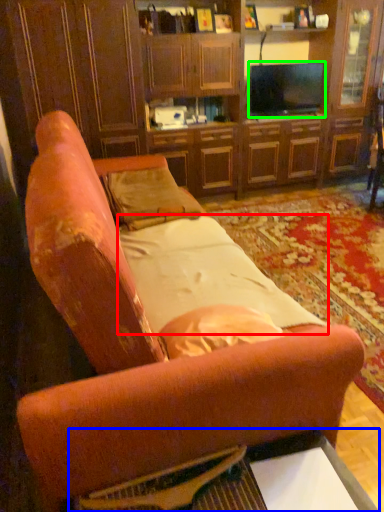
Question: Which is nearer to the sheet (highlighted by a red box)? table (highlighted by a blue box) or television (highlighted by a green box).

Choices:
 (A) table
 (B) television

Answer: (A)